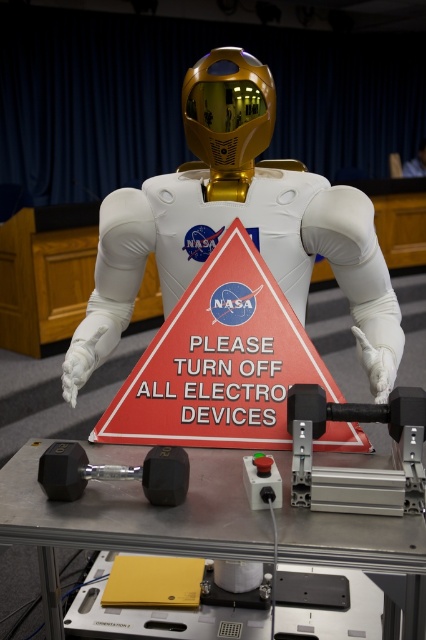
You are an astronaut preparing for a mission briefing and see the metallic gray table at center and the red plastic sign at center in the room. Which object would you need to interact with first according to standard safety protocols?

The red plastic sign at center instructs to turn off all electronic devices, so you should first acknowledge and comply with the sign before proceeding to the metallic gray table at center.

You are an astronaut preparing for a mission and see the white matte astronaut at center and the red plastic sign at center in the room. Which object is closer to you?

The white matte astronaut at center is closer to you because the red plastic sign at center is behind it.

You are an astronaut preparing for a mission briefing and see the metallic gray table at center and the red plastic sign at center in the room. Which object has a greater width?

The metallic gray table at center has a greater width than the red plastic sign at center.